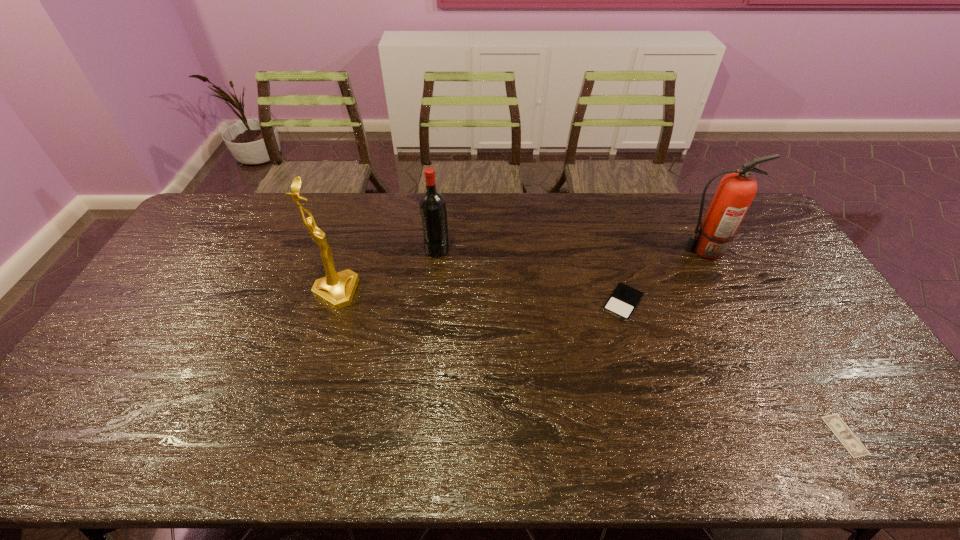
At what (x,y) coordinates should I click in order to perform the action: click on vacant space at the left edge of the desktop. Please return your answer as a coordinate pair (x, y). Looking at the image, I should click on (225, 249).

Identify the location of vacant space at the right edge of the desktop. (780, 323).

The height and width of the screenshot is (540, 960). What are the coordinates of `empty space that is in between the fire extinguisher and the wine bottle` in the screenshot? It's located at (570, 249).

At what (x,y) coordinates should I click in order to perform the action: click on free area in between the fourth tallest object and the nearest object. Please return your answer as a coordinate pair (x, y). Looking at the image, I should click on (733, 369).

You are a GUI agent. You are given a task and a screenshot of the screen. Output one action in this format:
    pyautogui.click(x=<x>, y=<y>)
    Task: Click on the free space between the award and the fire extinguisher
    The image size is (960, 540).
    Given the screenshot: What is the action you would take?
    pyautogui.click(x=519, y=271)

Where is `free area in between the money and the second object from left to right`? free area in between the money and the second object from left to right is located at coordinates (640, 342).

You are a GUI agent. You are given a task and a screenshot of the screen. Output one action in this format:
    pyautogui.click(x=<x>, y=<y>)
    Task: Click on the empty space that is in between the shortest object and the second object from left to right
    
    Given the screenshot: What is the action you would take?
    pyautogui.click(x=640, y=342)

This screenshot has width=960, height=540. Identify the location of free space between the third tallest object and the third object from right to left. (530, 275).

The image size is (960, 540). What are the coordinates of `unoccupied area between the third object from right to left and the award` in the screenshot? It's located at (479, 298).

This screenshot has width=960, height=540. Identify the location of empty location between the leftmost object and the wine bottle. (386, 270).